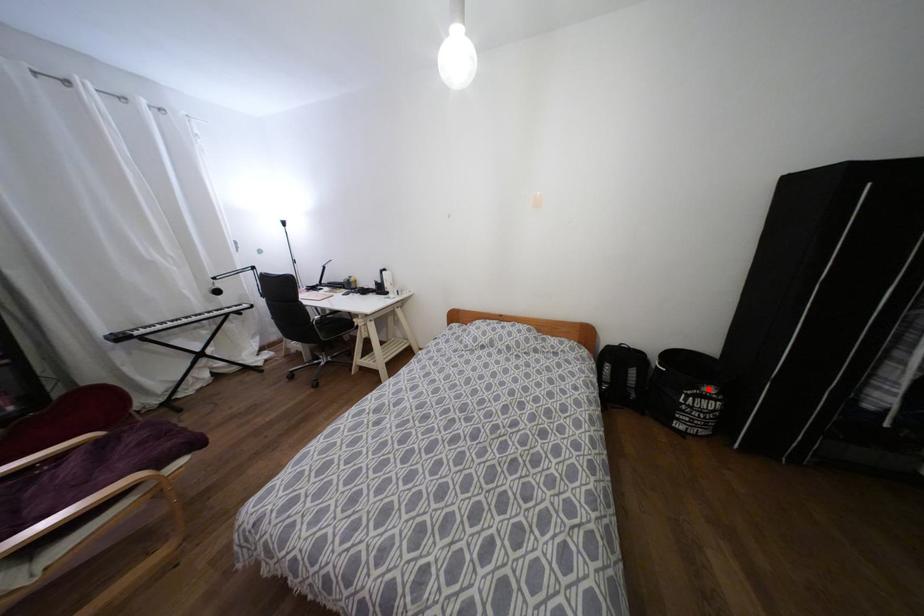
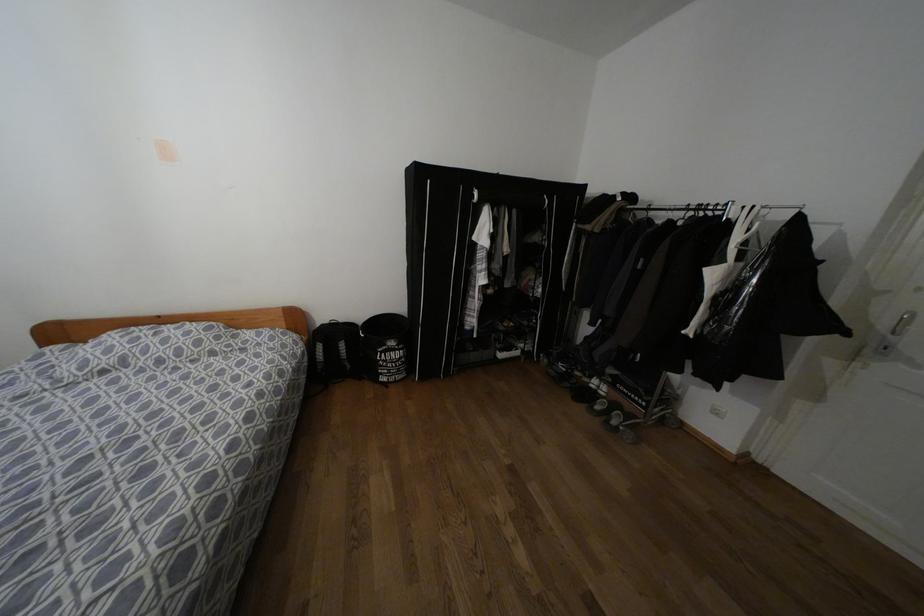
Find the pixel in the second image that matches the highlighted location in the first image.

(391, 342)